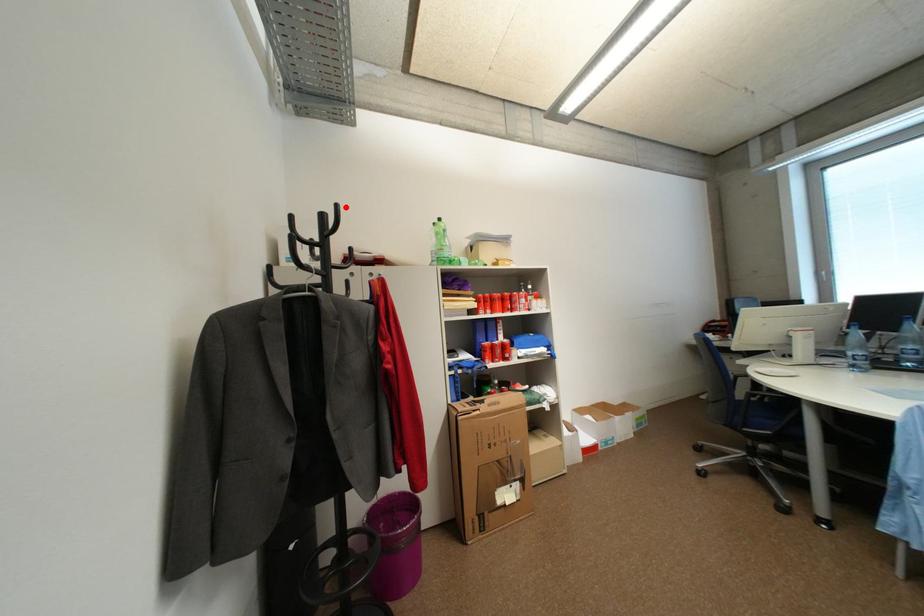
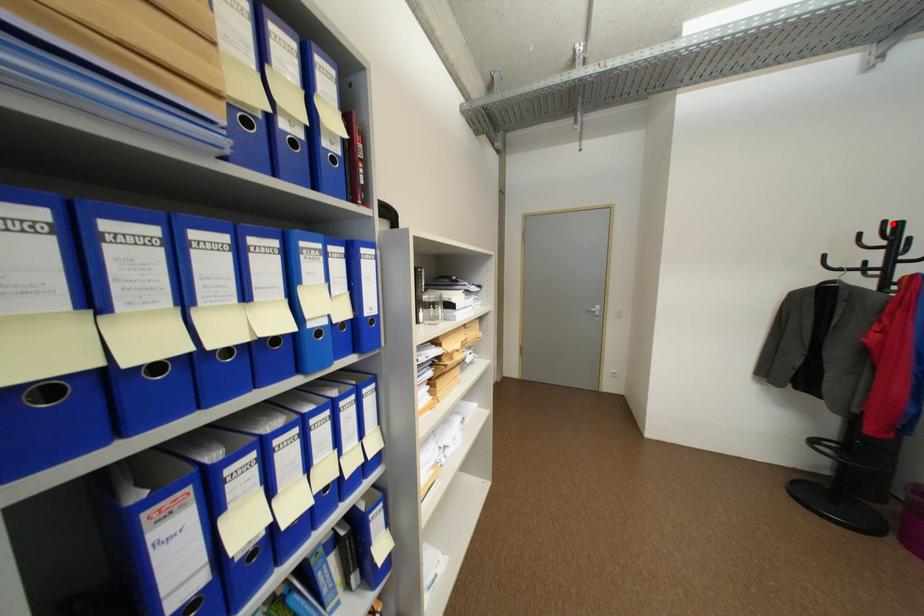
I am providing you with two images of the same scene from different viewpoints. A red point is marked on the first image and another point is marked on the second image. Is the marked point in image1 the same physical position as the marked point in image2?

Yes